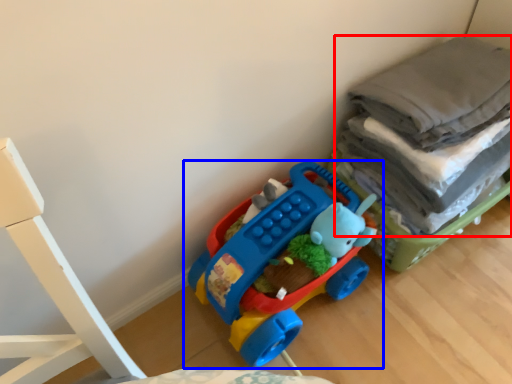
Question: Among these objects, which one is farthest to the camera, laundry (highlighted by a red box) or toy (highlighted by a blue box)?

Choices:
 (A) laundry
 (B) toy

Answer: (B)